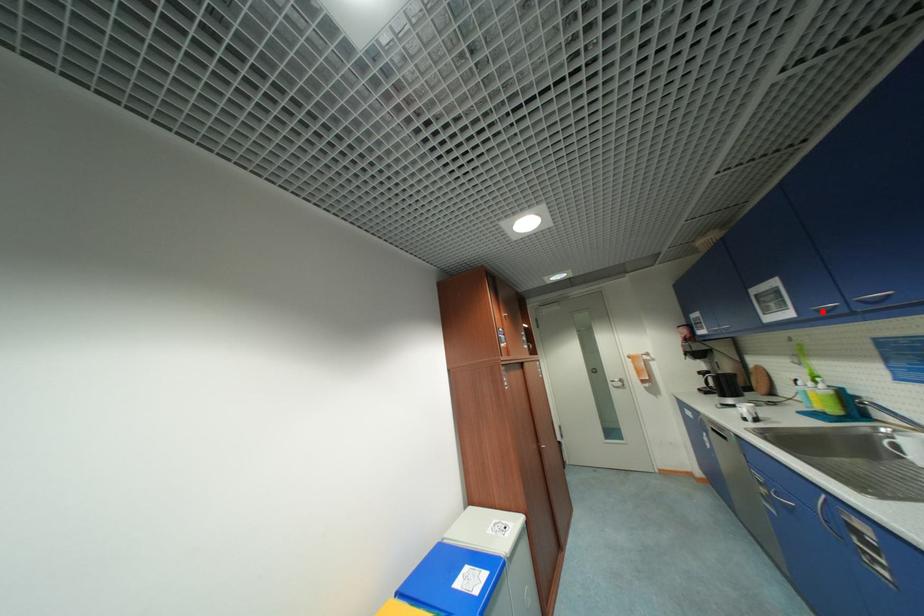
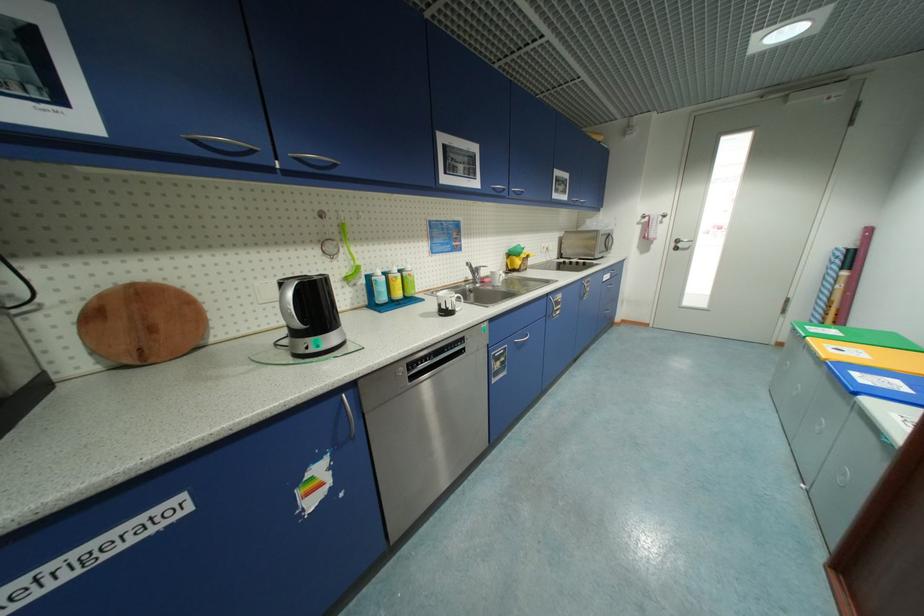
In the second image, find the point that corresponds to the highlighted location in the first image.

(499, 190)